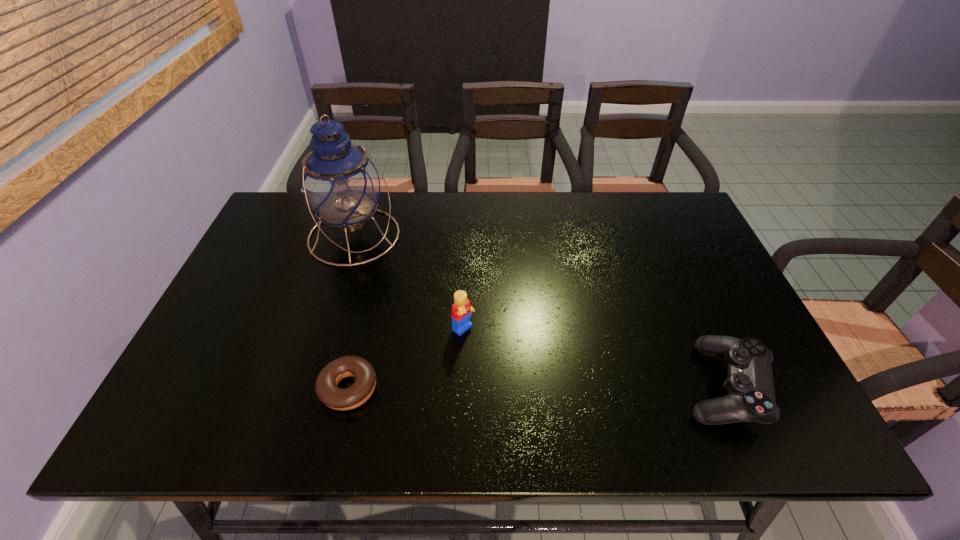
I want to click on free space on the desktop that is between the shortest object and the second shortest object and is positioned on the face of the Lego, so click(536, 387).

Find the location of a particular element. Image resolution: width=960 pixels, height=540 pixels. free spot on the desktop that is between the doughnut and the rightmost object and is positioned on the front-facing side of the tallest object is located at coordinates (488, 388).